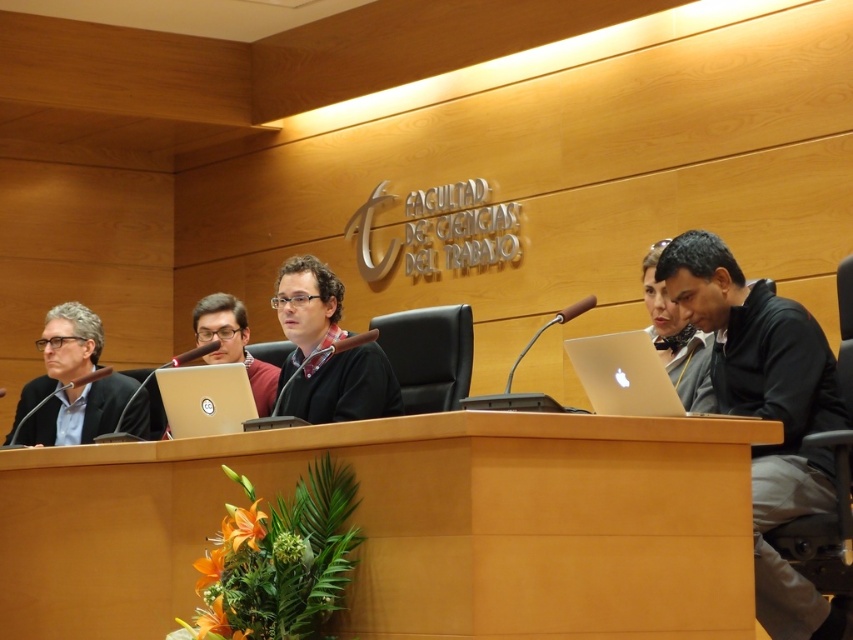
Question: Is black matte laptop at right positioned behind silver metallic laptop at center?

Choices:
 (A) yes
 (B) no

Answer: (B)

Question: Which object is farther from the camera taking this photo?

Choices:
 (A) black matte laptop at right
 (B) silver metallic laptop at right
 (C) matte black laptop at center
 (D) wooden table at center

Answer: (C)

Question: Based on their relative distances, which object is nearer to the matte black suit at left?

Choices:
 (A) matte black laptop at right
 (B) silver metallic laptop at center

Answer: (B)

Question: Is silver metallic laptop at right closer to the viewer compared to matte black laptop at center?

Choices:
 (A) no
 (B) yes

Answer: (B)

Question: Which object appears farthest from the camera in this image?

Choices:
 (A) matte black laptop at right
 (B) matte black laptop at center
 (C) silver metallic laptop at right
 (D) matte black sweater at center

Answer: (B)

Question: Does wooden table at center appear under matte black sweater at center?

Choices:
 (A) no
 (B) yes

Answer: (B)